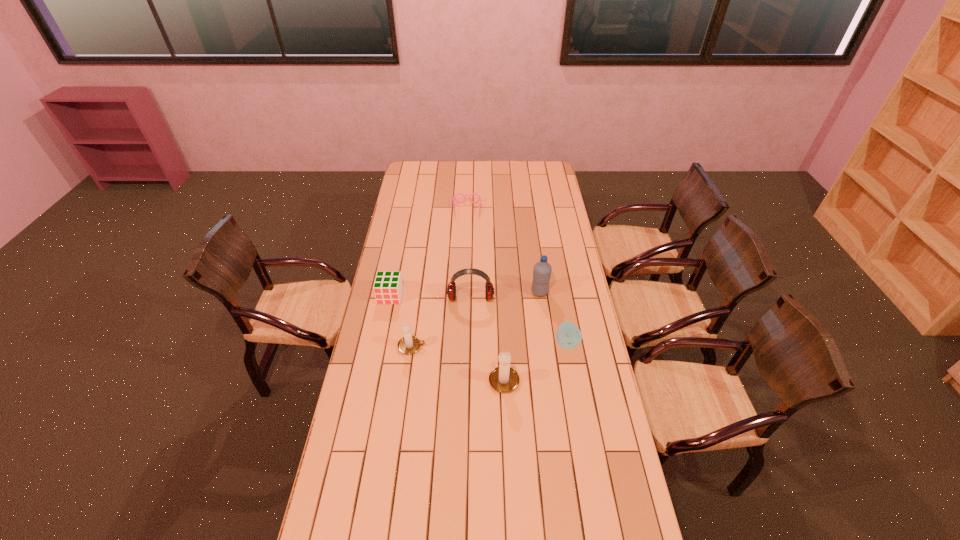
Identify the location of the farther candle holder. The image size is (960, 540). (409, 344).

Locate an element on the screen. This screenshot has width=960, height=540. the fourth shortest object is located at coordinates (409, 344).

This screenshot has height=540, width=960. In order to click on the right candle holder in this screenshot , I will do `click(503, 379)`.

Locate an element on the screen. The image size is (960, 540). the nearest object is located at coordinates (503, 379).

Find the location of a particular element. The height and width of the screenshot is (540, 960). spectacles is located at coordinates (454, 199).

Identify the location of the farthest object. This screenshot has height=540, width=960. (454, 199).

I want to click on earphone, so click(x=451, y=290).

Where is `apple`? apple is located at coordinates (568, 336).

Locate an element on the screen. The height and width of the screenshot is (540, 960). cube is located at coordinates (388, 287).

Find the location of a particular element. This screenshot has width=960, height=540. water bottle is located at coordinates (542, 270).